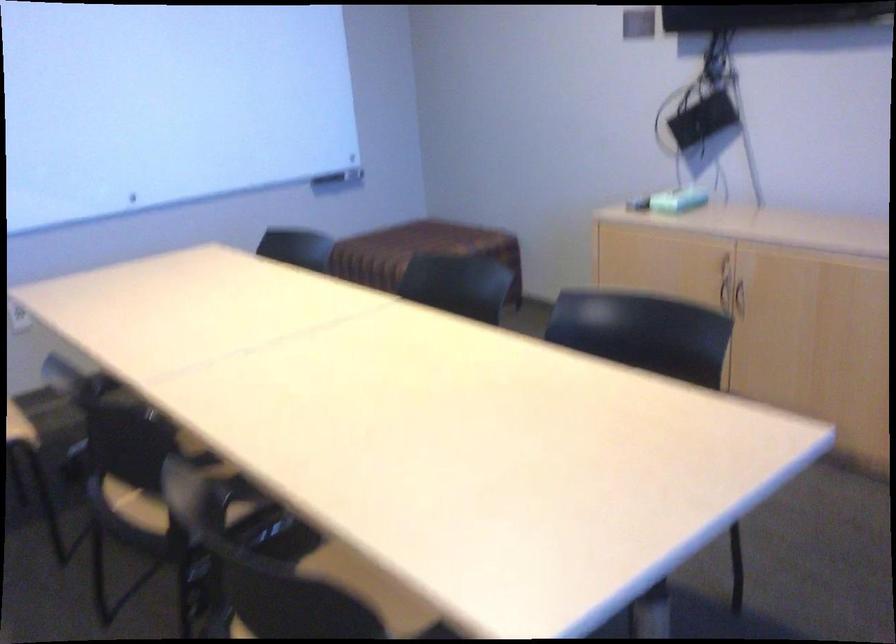
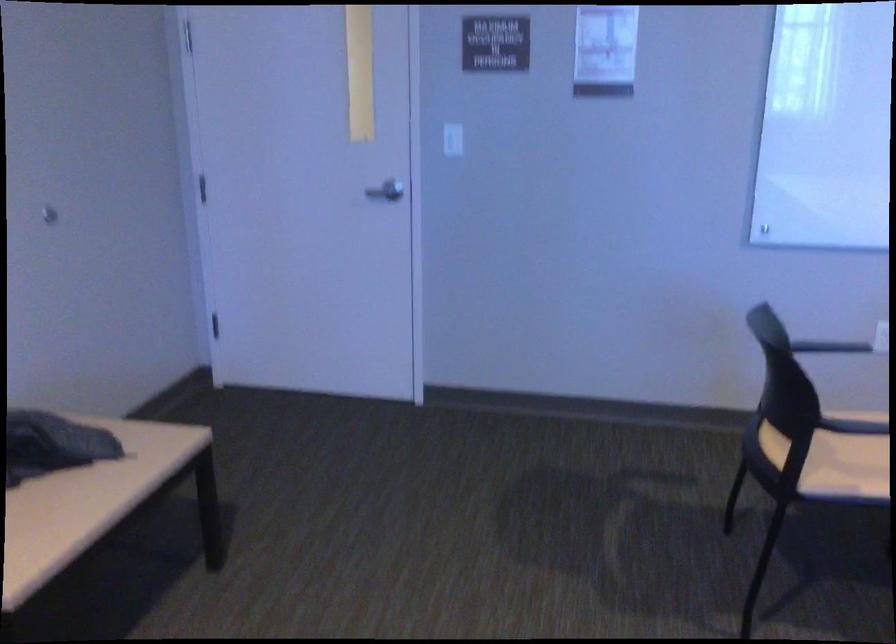
Question: How did the camera likely rotate?

Choices:
 (A) Left
 (B) Right
 (C) Up
 (D) Down

Answer: (A)